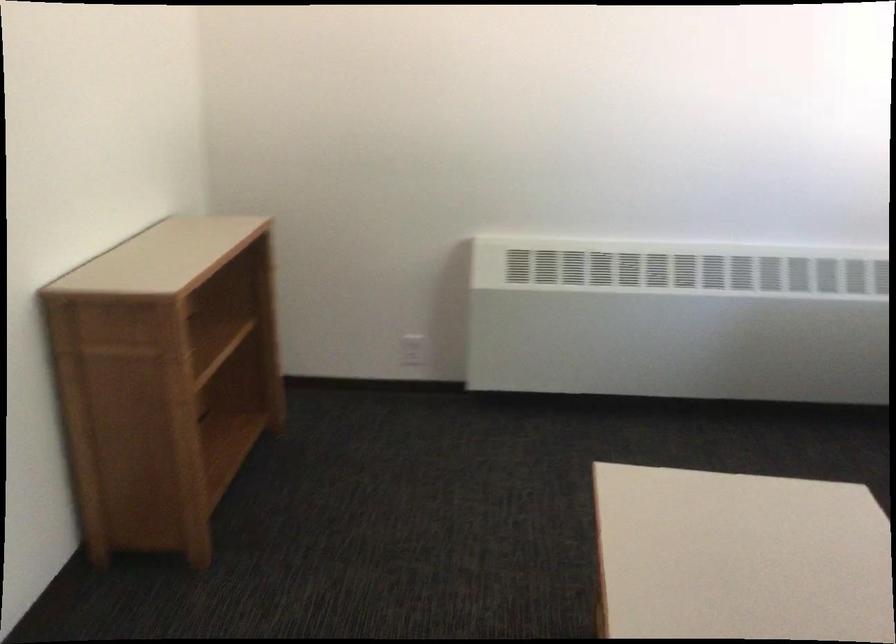
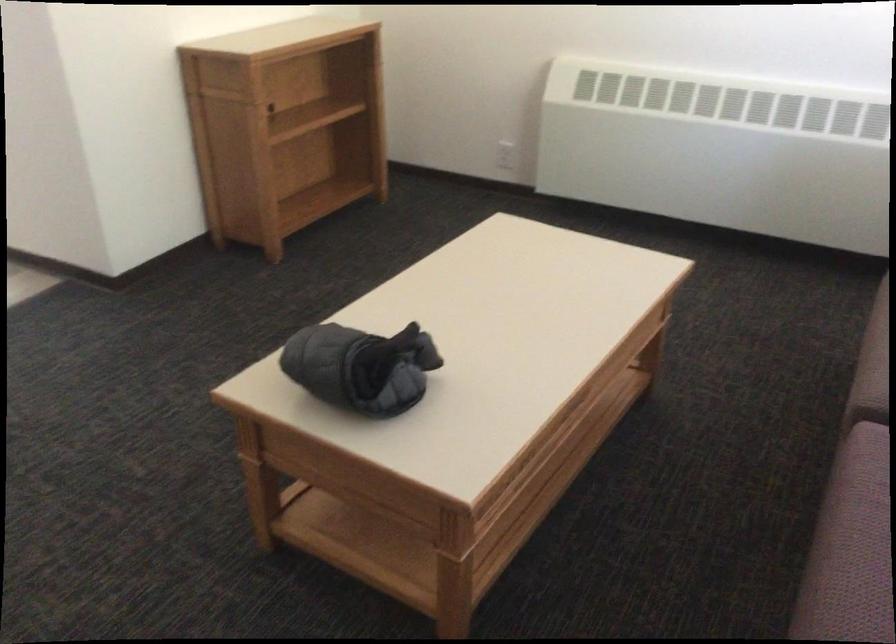
In the second image, find the point that corresponds to point 421,350 in the first image.

(505, 155)